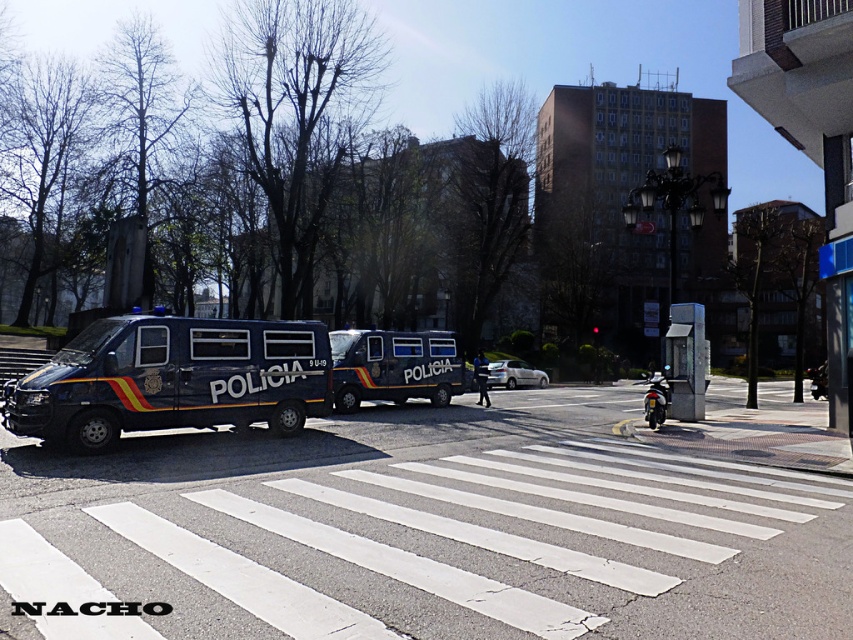
Which is more to the left, metallic blue van at left or white matte car at center?

From the viewer's perspective, metallic blue van at left appears more on the left side.

Does metallic blue van at left appear on the right side of white matte car at center?

In fact, metallic blue van at left is to the left of white matte car at center.

Measure the distance between metallic blue van at left and camera.

metallic blue van at left and camera are 11.70 meters apart.

Find the location of a particular element. Image resolution: width=853 pixels, height=640 pixels. metallic blue van at left is located at coordinates (173, 380).

Who is lower down, metallic blue van at left or shiny chrome motorcycle at right?

Positioned lower is shiny chrome motorcycle at right.

Can you confirm if metallic blue van at left is positioned below shiny chrome motorcycle at right?

No.

Between point (44, 422) and point (646, 396), which one is positioned behind?

Positioned behind is point (646, 396).

At what (x,y) coordinates should I click in order to perform the action: click on metallic blue van at left. Please return your answer as a coordinate pair (x, y). The width and height of the screenshot is (853, 640). Looking at the image, I should click on (173, 380).

Can you confirm if polished blue van at center is thinner than shiny chrome motorcycle at right?

Yes, polished blue van at center is thinner than shiny chrome motorcycle at right.

Between polished blue van at center and shiny chrome motorcycle at right, which one is positioned higher?

Positioned higher is polished blue van at center.

Describe the element at coordinates (393, 365) in the screenshot. I see `polished blue van at center` at that location.

This screenshot has width=853, height=640. Find the location of `polished blue van at center`. polished blue van at center is located at coordinates (393, 365).